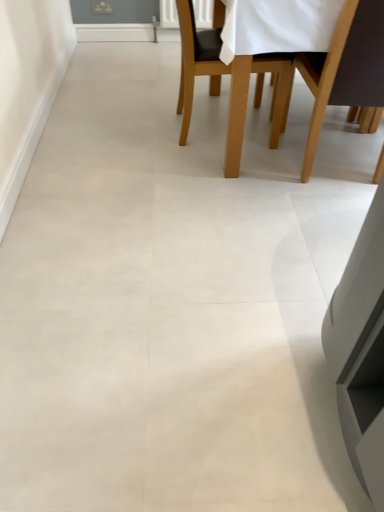
Where is `free spot to the right of light brown wooden chair at upper center, which appears as the 1th chair when viewed from the left`? The image size is (384, 512). free spot to the right of light brown wooden chair at upper center, which appears as the 1th chair when viewed from the left is located at coordinates (268, 130).